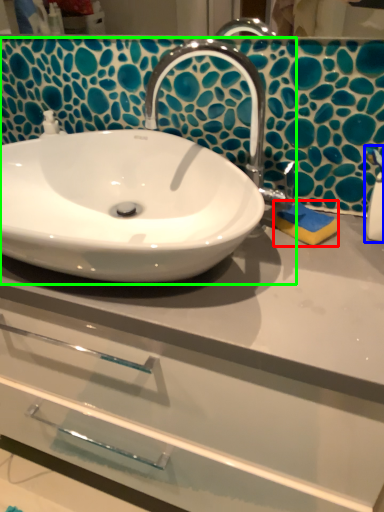
Question: Estimate the real-world distances between objects in this image. Which object is closer to soap (highlighted by a red box), soap dispenser (highlighted by a blue box) or sink (highlighted by a green box)?

Choices:
 (A) soap dispenser
 (B) sink

Answer: (A)